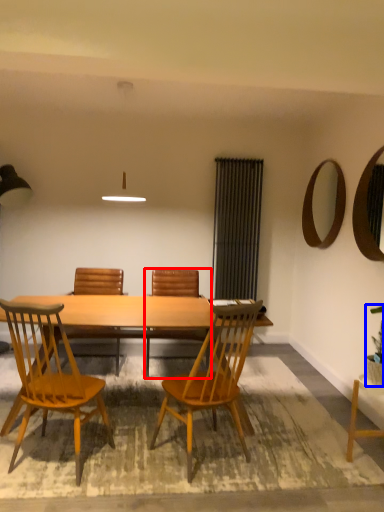
Question: Which of the following is the closest to the observer, chair (highlighted by a red box) or houseplant (highlighted by a blue box)?

Choices:
 (A) chair
 (B) houseplant

Answer: (B)